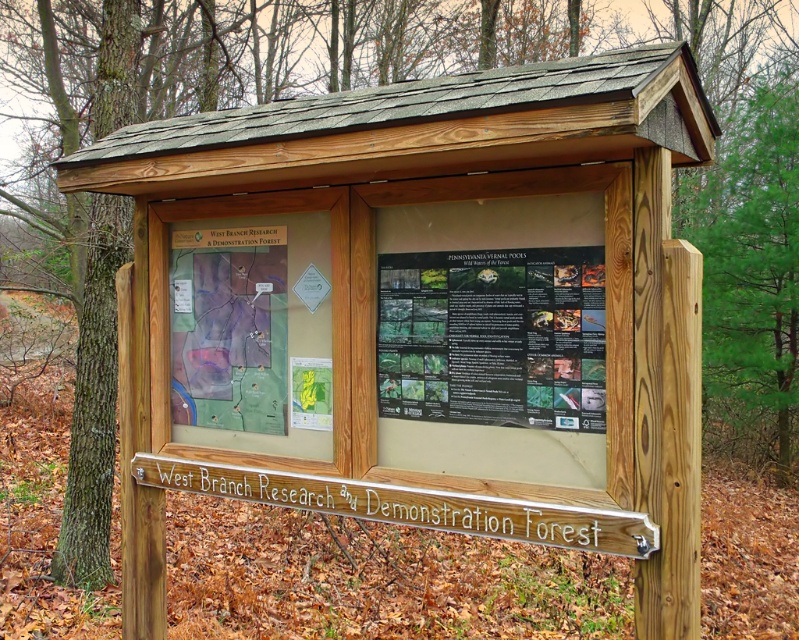
Question: Can you confirm if black paper poster at center is positioned below transparent plastic map at center?

Choices:
 (A) no
 (B) yes

Answer: (B)

Question: Which object appears farthest from the camera in this image?

Choices:
 (A) black paper poster at center
 (B) transparent plastic map at center

Answer: (B)

Question: Does black paper poster at center appear on the left side of transparent plastic map at center?

Choices:
 (A) yes
 (B) no

Answer: (B)

Question: Which of the following is the closest to the observer?

Choices:
 (A) coord(591,321)
 (B) coord(197,272)

Answer: (A)

Question: Can you confirm if black paper poster at center is thinner than transparent plastic map at center?

Choices:
 (A) yes
 (B) no

Answer: (B)